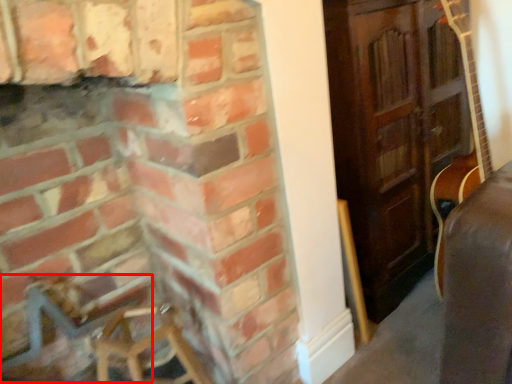
Question: From the image's perspective, what is the correct spatial relationship of armchair (annotated by the red box) in relation to fireplace?

Choices:
 (A) above
 (B) below

Answer: (B)